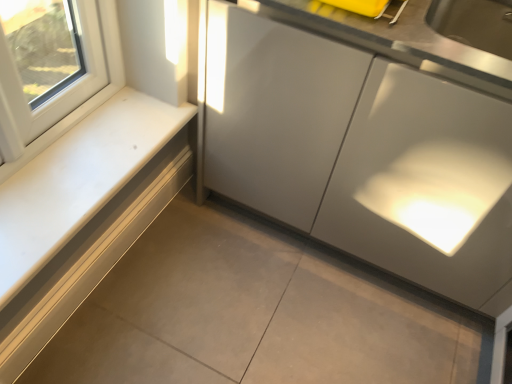
Describe the element at coordinates (93, 219) in the screenshot. The width and height of the screenshot is (512, 384). I see `white glossy countertop at left` at that location.

Find the location of a particular element. The width and height of the screenshot is (512, 384). white glossy countertop at left is located at coordinates (93, 219).

You are a GUI agent. You are given a task and a screenshot of the screen. Output one action in this format:
    pyautogui.click(x=<x>, y=<y>)
    Task: Click on the white glossy countertop at left
    The image size is (512, 384).
    Given the screenshot: What is the action you would take?
    pyautogui.click(x=93, y=219)